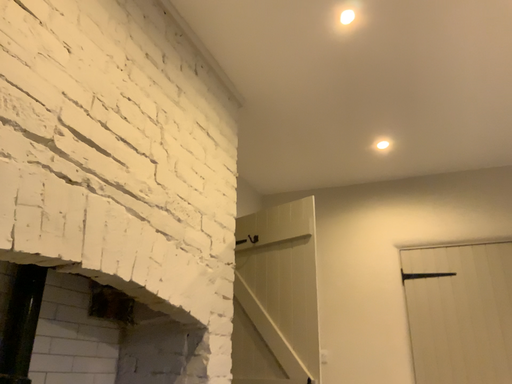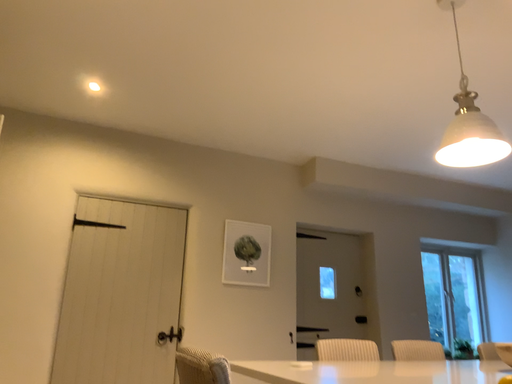
Question: How did the camera likely rotate when shooting the video?

Choices:
 (A) rotated left
 (B) rotated right

Answer: (B)